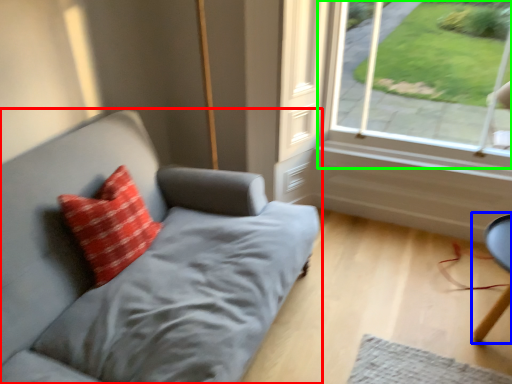
Question: Which object is positioned closest to studio couch (highlighted by a red box)? Select from computer chair (highlighted by a blue box) and window (highlighted by a green box).

Choices:
 (A) computer chair
 (B) window

Answer: (B)